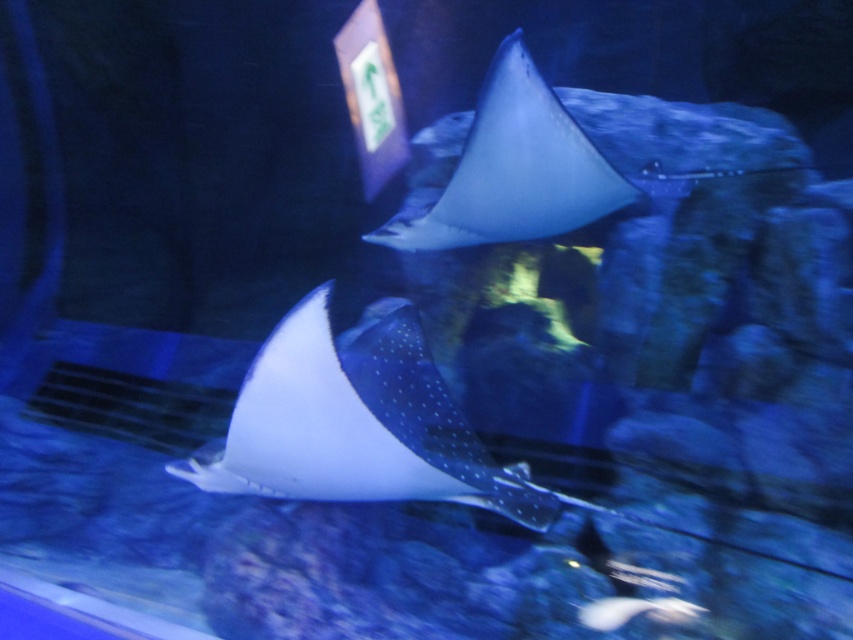
Between white dotted stingray at center and white dotted stingray at upper center, which one appears on the right side from the viewer's perspective?

white dotted stingray at upper center

Is point (230, 488) farther from viewer compared to point (512, 180)?

No.

Locate an element on the screen. This screenshot has height=640, width=853. white dotted stingray at center is located at coordinates (357, 422).